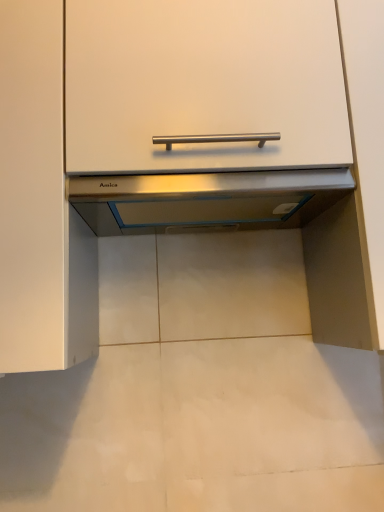
Question: Considering the relative sizes of satin silver exhaust hood at center and satin silver cabinet at center in the image provided, is satin silver exhaust hood at center thinner than satin silver cabinet at center?

Choices:
 (A) no
 (B) yes

Answer: (B)

Question: Does satin silver exhaust hood at center appear on the right side of satin silver cabinet at center?

Choices:
 (A) no
 (B) yes

Answer: (B)

Question: Could satin silver cabinet at center be considered to be inside satin silver exhaust hood at center?

Choices:
 (A) yes
 (B) no

Answer: (B)

Question: Is the depth of satin silver exhaust hood at center greater than that of satin silver cabinet at center?

Choices:
 (A) no
 (B) yes

Answer: (B)

Question: From the image's perspective, is satin silver exhaust hood at center on top of satin silver cabinet at center?

Choices:
 (A) no
 (B) yes

Answer: (A)

Question: Considering the relative sizes of satin silver exhaust hood at center and satin silver cabinet at center in the image provided, is satin silver exhaust hood at center smaller than satin silver cabinet at center?

Choices:
 (A) yes
 (B) no

Answer: (A)

Question: From the image's perspective, would you say satin silver cabinet at center is shown under satin silver exhaust hood at center?

Choices:
 (A) no
 (B) yes

Answer: (A)

Question: Does satin silver cabinet at center come behind satin silver exhaust hood at center?

Choices:
 (A) yes
 (B) no

Answer: (B)

Question: Is satin silver cabinet at center next to satin silver exhaust hood at center?

Choices:
 (A) yes
 (B) no

Answer: (B)

Question: Is satin silver exhaust hood at center completely or partially inside satin silver cabinet at center?

Choices:
 (A) yes
 (B) no

Answer: (A)

Question: From the image's perspective, would you say satin silver cabinet at center is positioned over satin silver exhaust hood at center?

Choices:
 (A) no
 (B) yes

Answer: (B)

Question: Is the position of satin silver cabinet at center less distant than that of satin silver exhaust hood at center?

Choices:
 (A) no
 (B) yes

Answer: (B)

Question: In the image, is satin silver cabinet at center positioned in front of or behind satin silver exhaust hood at center?

Choices:
 (A) front
 (B) behind

Answer: (A)